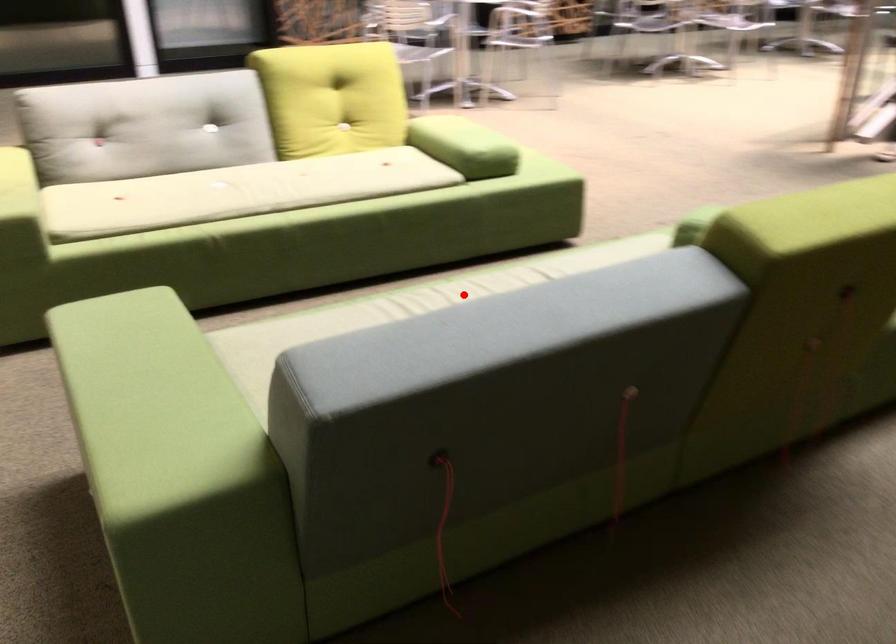
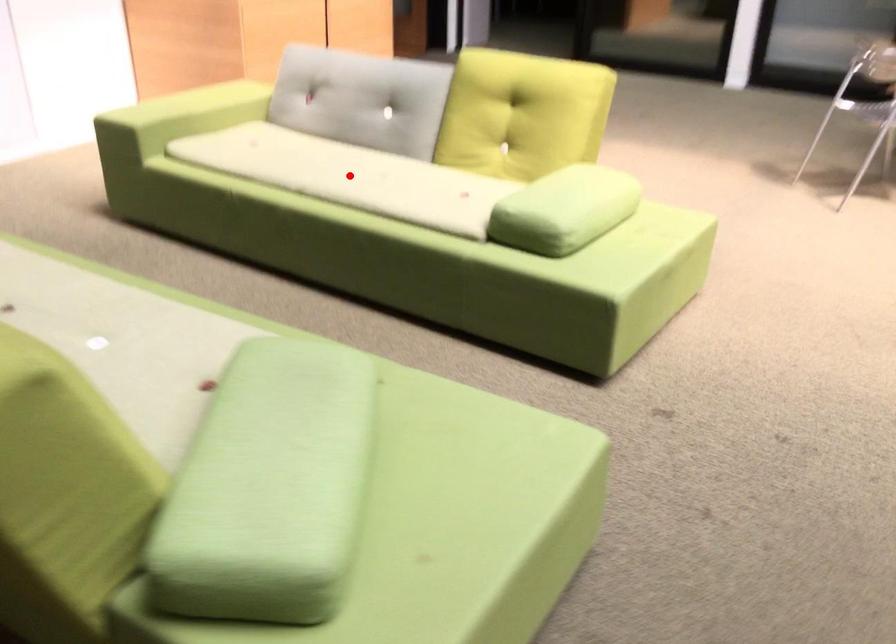
I am providing you with two images of the same scene from different viewpoints. A red point is marked on the first image and another point is marked on the second image. Is the red point in image1 aligned with the point shown in image2?

No